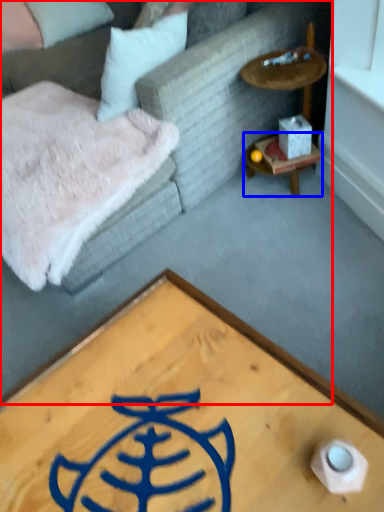
Question: Among these objects, which one is nearest to the camera, studio couch (highlighted by a red box) or table (highlighted by a blue box)?

Choices:
 (A) studio couch
 (B) table

Answer: (A)